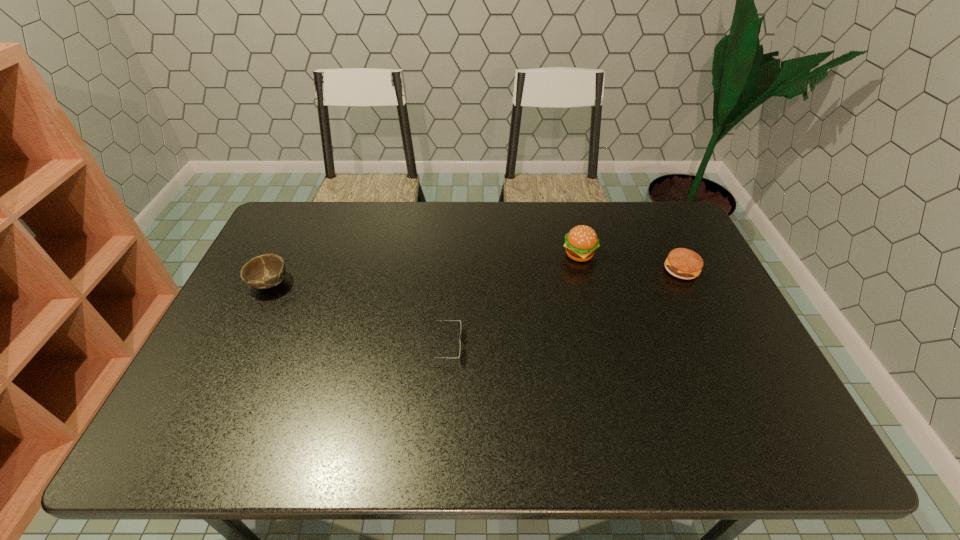
You are a GUI agent. You are given a task and a screenshot of the screen. Output one action in this format:
    pyautogui.click(x=<x>, y=<y>)
    Task: Click on the vacant point located between the leftmost object and the second object from right to left
    The height and width of the screenshot is (540, 960).
    Given the screenshot: What is the action you would take?
    pos(424,269)

You are a GUI agent. You are given a task and a screenshot of the screen. Output one action in this format:
    pyautogui.click(x=<x>, y=<y>)
    Task: Click on the vacant space that is in between the taller hamburger and the bowl
    The height and width of the screenshot is (540, 960).
    Given the screenshot: What is the action you would take?
    pyautogui.click(x=424, y=269)

Locate an element on the screen. Image resolution: width=960 pixels, height=540 pixels. unoccupied area between the rightmost object and the nearest object is located at coordinates (561, 308).

The image size is (960, 540). In order to click on free space between the tallest object and the right hamburger in this screenshot , I will do coord(631,262).

Locate an element on the screen. This screenshot has height=540, width=960. free area in between the nearest object and the leftmost object is located at coordinates (355, 314).

Locate an element on the screen. vacant point located between the leftmost object and the rightmost object is located at coordinates (475, 276).

Where is `free area in between the taller hamburger and the bowl`? This screenshot has height=540, width=960. free area in between the taller hamburger and the bowl is located at coordinates (424, 269).

Locate an element on the screen. The height and width of the screenshot is (540, 960). free space between the bowl and the nearest object is located at coordinates (355, 314).

The width and height of the screenshot is (960, 540). I want to click on vacant area that lies between the leftmost object and the rightmost object, so click(475, 276).

Locate which object is the third closest to the right hamburger. Please provide its 2D coordinates. Your answer should be formatted as a tuple, i.e. [(x, y)], where the tuple contains the x and y coordinates of a point satisfying the conditions above.

[(265, 271)]